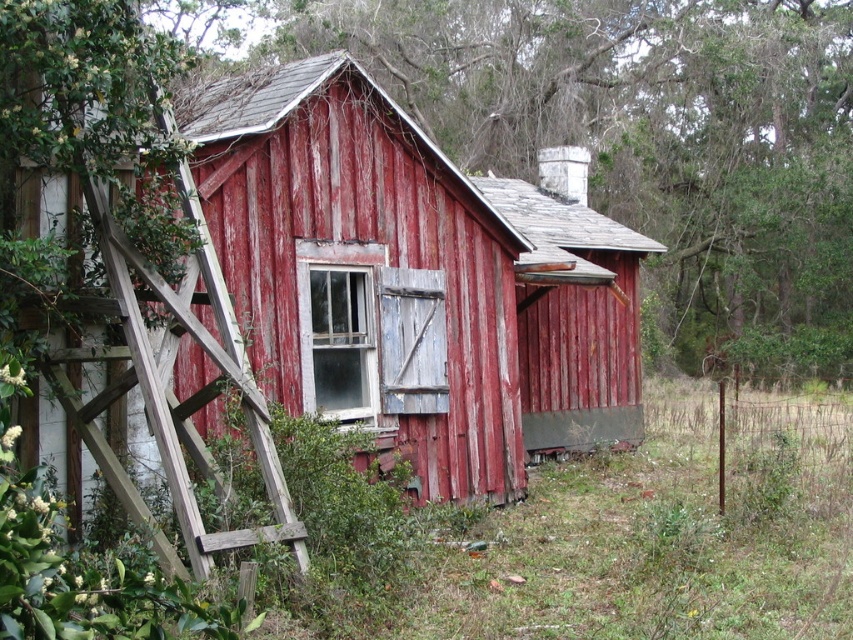
Can you confirm if rusty wood barn at center is positioned to the right of smooth wooden fence at center?

Incorrect, rusty wood barn at center is not on the right side of smooth wooden fence at center.

What do you see at coordinates (387, 289) in the screenshot? The width and height of the screenshot is (853, 640). I see `rusty wood barn at center` at bounding box center [387, 289].

This screenshot has width=853, height=640. Identify the location of rusty wood barn at center. (387, 289).

Between rusty wood barn at center and weathered wood ladder at left, which one appears on the left side from the viewer's perspective?

weathered wood ladder at left

Does point (415, 252) come in front of point (277, 513)?

No, (415, 252) is further to viewer.

Where is `rusty wood barn at center`? The width and height of the screenshot is (853, 640). rusty wood barn at center is located at coordinates (387, 289).

From the picture: Does smooth wooden fence at center appear over weathered wood ladder at left?

Indeed, smooth wooden fence at center is positioned over weathered wood ladder at left.

Describe the element at coordinates (651, 140) in the screenshot. I see `smooth wooden fence at center` at that location.

Does point (521, 132) lie in front of point (241, 538)?

No, it is not.

Where is `smooth wooden fence at center`? The height and width of the screenshot is (640, 853). smooth wooden fence at center is located at coordinates (651, 140).